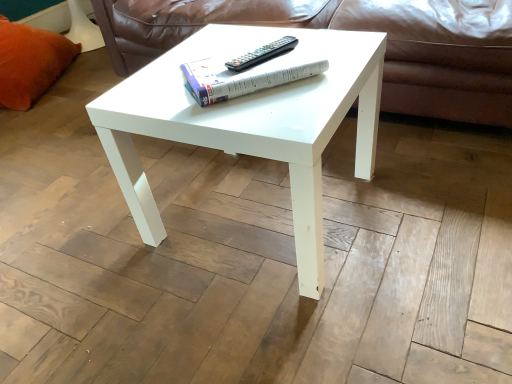
Locate an element on the screen. vacant space underneath white glossy coffee table at center (from a real-world perspective) is located at coordinates (251, 211).